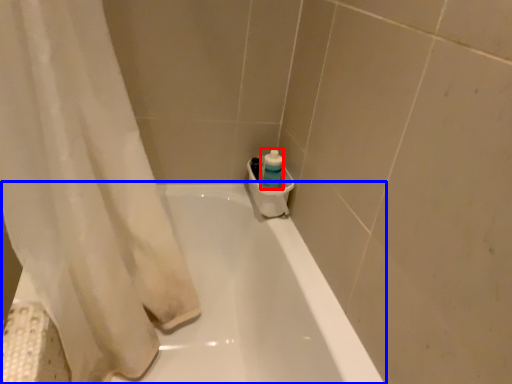
Question: Among these objects, which one is nearest to the camera, cleaning product (highlighted by a red box) or bathtub (highlighted by a blue box)?

Choices:
 (A) cleaning product
 (B) bathtub

Answer: (B)